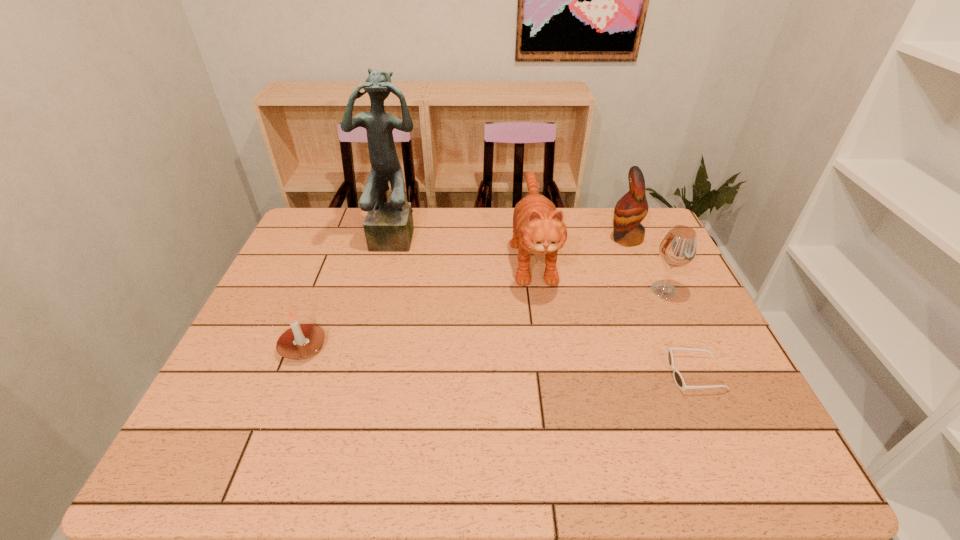
This screenshot has height=540, width=960. Find the location of `parrot that is positioned at the far edge`. parrot that is positioned at the far edge is located at coordinates (632, 208).

Image resolution: width=960 pixels, height=540 pixels. In order to click on object located at the left edge in this screenshot , I will do `click(300, 341)`.

The image size is (960, 540). Find the location of `parrot that is positioned at the right edge`. parrot that is positioned at the right edge is located at coordinates (632, 208).

Find the location of a particular element. wineglass that is at the right edge is located at coordinates (678, 248).

Identify the location of sunglasses positioned at the right edge. (678, 378).

I want to click on object that is at the far right corner, so click(x=632, y=208).

Find the location of a particular element. free space at the far edge of the desktop is located at coordinates pos(487,227).

The height and width of the screenshot is (540, 960). In order to click on free location at the near edge in this screenshot , I will do `click(678, 457)`.

Locate an element on the screen. The image size is (960, 540). free space at the left edge of the desktop is located at coordinates (335, 266).

Locate an element on the screen. The height and width of the screenshot is (540, 960). vacant space at the right edge is located at coordinates (x=690, y=321).